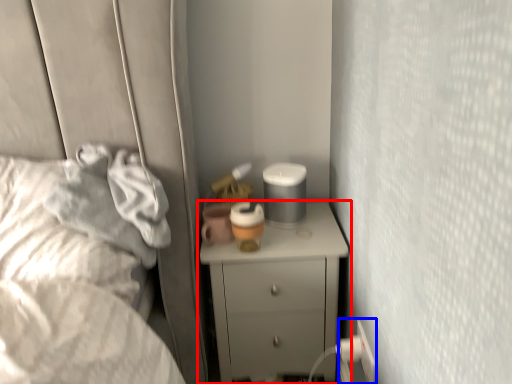
Question: Among these objects, which one is farthest to the camera, chest of drawers (highlighted by a red box) or electric outlet (highlighted by a blue box)?

Choices:
 (A) chest of drawers
 (B) electric outlet

Answer: (A)